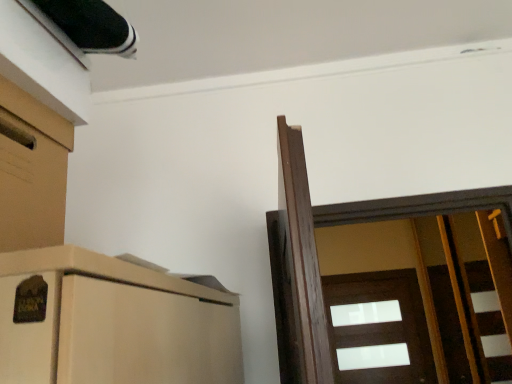
What do you see at coordinates (379, 328) in the screenshot?
I see `white glossy door at center right` at bounding box center [379, 328].

Locate an element on the screen. The image size is (512, 384). white glossy door at center right is located at coordinates (379, 328).

Where is `white glossy door at center right`? This screenshot has height=384, width=512. white glossy door at center right is located at coordinates (379, 328).